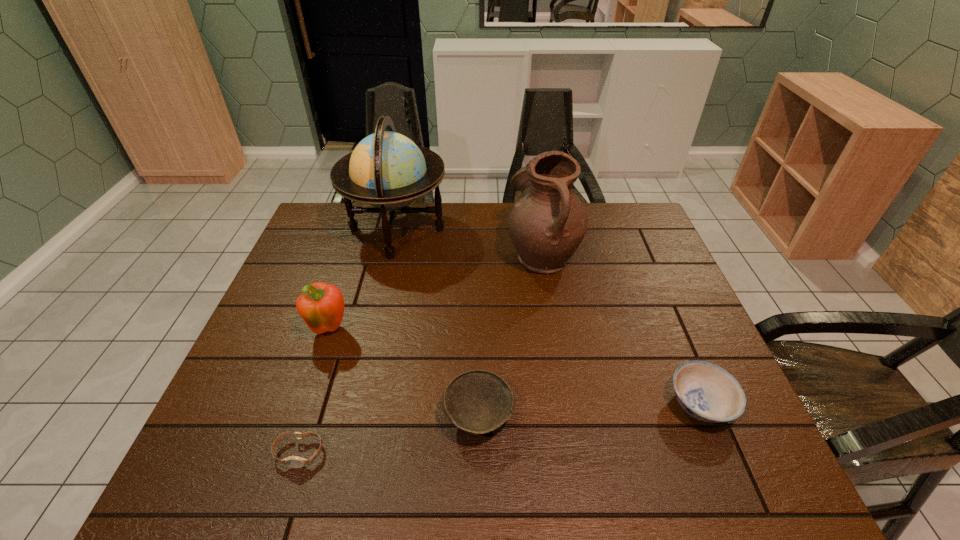
This screenshot has height=540, width=960. Find the location of `globe`. globe is located at coordinates (387, 170).

This screenshot has height=540, width=960. Find the location of `the second object from right to left`. the second object from right to left is located at coordinates (546, 224).

The image size is (960, 540). I want to click on the third tallest object, so click(x=321, y=306).

The width and height of the screenshot is (960, 540). In order to click on pepper in this screenshot , I will do `click(321, 306)`.

Where is `the left bowl`? the left bowl is located at coordinates (478, 401).

You are a GUI agent. You are given a task and a screenshot of the screen. Output one action in this format:
    pyautogui.click(x=<x>, y=<y>)
    Task: Click on the third shortest object
    Image resolution: width=960 pixels, height=540 pixels.
    Given the screenshot: What is the action you would take?
    pyautogui.click(x=478, y=401)

You are a GUI agent. You are given a task and a screenshot of the screen. Output one action in this format:
    pyautogui.click(x=<x>, y=<y>)
    Task: Click on the fifth tallest object
    This screenshot has width=960, height=540.
    Given the screenshot: What is the action you would take?
    pyautogui.click(x=707, y=392)

I want to click on the right bowl, so click(x=707, y=392).

This screenshot has width=960, height=540. Find the location of `the shortest object`. the shortest object is located at coordinates pyautogui.click(x=293, y=461).

Where is `free region located on the surface of the globe`? free region located on the surface of the globe is located at coordinates (532, 230).